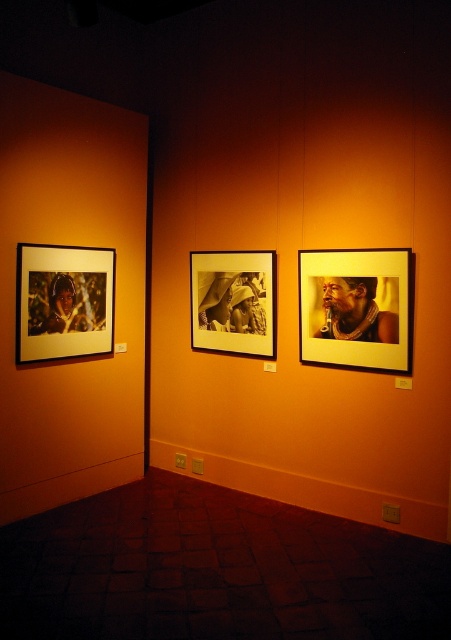
Question: Among these objects, which one is nearest to the camera?

Choices:
 (A) matte glass photo frame at left
 (B) matte glass photo frame at center right

Answer: (B)

Question: Can you confirm if matte glass photo frame at center right is positioned above wooden frame at center?

Choices:
 (A) yes
 (B) no

Answer: (B)

Question: Does matte glass photo frame at left have a smaller size compared to wooden frame at center?

Choices:
 (A) yes
 (B) no

Answer: (B)

Question: Does matte glass photo frame at left appear on the left side of wooden frame at center?

Choices:
 (A) yes
 (B) no

Answer: (A)

Question: Which object is farther from the camera taking this photo?

Choices:
 (A) wooden frame at center
 (B) matte glass photo frame at center right
 (C) matte glass photo frame at left

Answer: (A)

Question: Estimate the real-world distances between objects in this image. Which object is farther from the wooden frame at center?

Choices:
 (A) matte glass photo frame at center right
 (B) matte glass photo frame at left

Answer: (B)